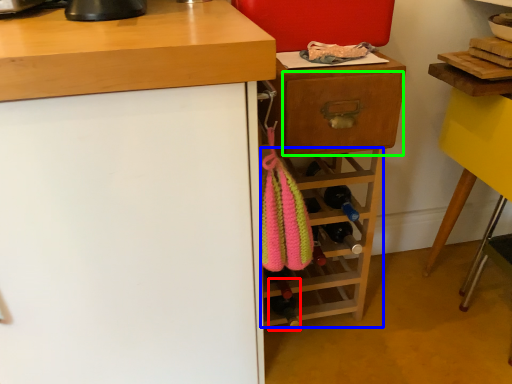
Question: Which object is positioned farthest from bottle (highlighted by a red box)? Select from shelf (highlighted by a blue box) and drawer (highlighted by a green box).

Choices:
 (A) shelf
 (B) drawer

Answer: (B)